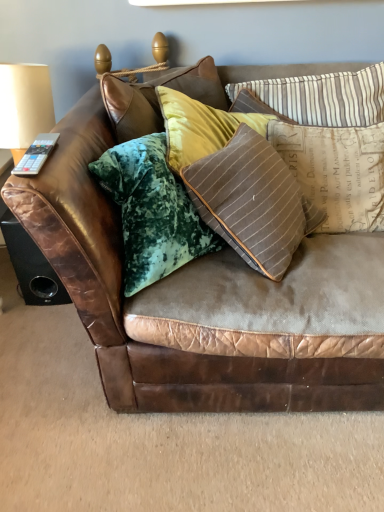
Describe the element at coordinates (31, 265) in the screenshot. I see `brown leather speaker at lower left` at that location.

I want to click on striped fabric pillow at upper right, placed as the first pillow when sorted from top to bottom, so click(322, 96).

Locate an element on the screen. This screenshot has height=512, width=384. matte beige lampshade at upper left is located at coordinates (24, 106).

Find the location of `brown leather speaker at lower left`. brown leather speaker at lower left is located at coordinates (31, 265).

Does point (364, 180) lie behind point (30, 170)?

Yes, it is.

Find the location of `the 2nd pillow counting from the right of the gray plastic remote at upper left`. the 2nd pillow counting from the right of the gray plastic remote at upper left is located at coordinates (336, 170).

Is brown striped pillow at upper right, positioned as the first pillow in bottom-to-top order, positioned beyond the bounds of gray plastic remote at upper left?

Yes, brown striped pillow at upper right, positioned as the first pillow in bottom-to-top order, is outside of gray plastic remote at upper left.

Is brown striped pillow at upper right, arranged as the second pillow when viewed from the top, wider than gray plastic remote at upper left?

Indeed, brown striped pillow at upper right, arranged as the second pillow when viewed from the top, has a greater width compared to gray plastic remote at upper left.

Is striped fabric pillow at upper right, placed as the first pillow when sorted from top to bottom, looking in the opposite direction of gray plastic remote at upper left?

No, gray plastic remote at upper left is not at the back of striped fabric pillow at upper right, placed as the first pillow when sorted from top to bottom.

From the picture: Can you confirm if striped fabric pillow at upper right, placed as the first pillow when sorted from top to bottom, is wider than gray plastic remote at upper left?

Incorrect, the width of striped fabric pillow at upper right, placed as the first pillow when sorted from top to bottom, does not surpass that of gray plastic remote at upper left.

The height and width of the screenshot is (512, 384). What are the coordinates of `pillow that is the 1st object directly below the gray plastic remote at upper left (from a real-world perspective)` in the screenshot? It's located at (x=322, y=96).

Between point (340, 114) and point (22, 165), which one is positioned in front?

The point (22, 165) is closer to the camera.

You are a GUI agent. You are given a task and a screenshot of the screen. Output one action in this format:
    pyautogui.click(x=<x>, y=<y>)
    Task: Click on the 1st pillow positioned above the brown leather speaker at lower left (from a real-world perspective)
    
    Given the screenshot: What is the action you would take?
    pyautogui.click(x=336, y=170)

Is brown striped pillow at upper right, positioned as the first pillow in bottom-to-top order, positioned with its back to brown leather speaker at lower left?

No, brown striped pillow at upper right, positioned as the first pillow in bottom-to-top order, is not facing the opposite direction of brown leather speaker at lower left.

Can you confirm if brown striped pillow at upper right, arranged as the second pillow when viewed from the top, is bigger than brown leather speaker at lower left?

Indeed, brown striped pillow at upper right, arranged as the second pillow when viewed from the top, has a larger size compared to brown leather speaker at lower left.

Is brown striped pillow at upper right, arranged as the second pillow when viewed from the top, directly adjacent to brown leather speaker at lower left?

They are not placed beside each other.

How different are the orientations of brown leather speaker at lower left and gray plastic remote at upper left in degrees?

The angle between the facing direction of brown leather speaker at lower left and the facing direction of gray plastic remote at upper left is 0.657 degrees.

Is brown leather speaker at lower left aimed at gray plastic remote at upper left?

No, brown leather speaker at lower left is not aimed at gray plastic remote at upper left.

Considering the relative sizes of brown leather speaker at lower left and gray plastic remote at upper left in the image provided, is brown leather speaker at lower left taller than gray plastic remote at upper left?

Indeed, brown leather speaker at lower left has a greater height compared to gray plastic remote at upper left.

Is brown leather speaker at lower left placed right next to gray plastic remote at upper left?

No, brown leather speaker at lower left is not touching gray plastic remote at upper left.

Could you tell me if brown striped pillow at upper right, arranged as the second pillow when viewed from the top, is turned towards striped fabric pillow at upper right, which appears as the second pillow when ordered from the bottom?

No, brown striped pillow at upper right, arranged as the second pillow when viewed from the top, is not aimed at striped fabric pillow at upper right, which appears as the second pillow when ordered from the bottom.

Considering the sizes of objects brown striped pillow at upper right, arranged as the second pillow when viewed from the top, and striped fabric pillow at upper right, which appears as the second pillow when ordered from the bottom, in the image provided, who is shorter, brown striped pillow at upper right, arranged as the second pillow when viewed from the top, or striped fabric pillow at upper right, which appears as the second pillow when ordered from the bottom,?

striped fabric pillow at upper right, which appears as the second pillow when ordered from the bottom, is shorter.

Is brown striped pillow at upper right, arranged as the second pillow when viewed from the top, closer to the viewer compared to striped fabric pillow at upper right, which appears as the second pillow when ordered from the bottom?

That is True.

Is brown striped pillow at upper right, positioned as the first pillow in bottom-to-top order, situated inside striped fabric pillow at upper right, which appears as the second pillow when ordered from the bottom, or outside?

brown striped pillow at upper right, positioned as the first pillow in bottom-to-top order, is located beyond the bounds of striped fabric pillow at upper right, which appears as the second pillow when ordered from the bottom.

From a real-world perspective, which object rests below the other?

From a 3D spatial view, brown striped pillow at upper right, arranged as the second pillow when viewed from the top, is below.

Identify the location of table lamp positioned vertically above the brown striped pillow at upper right, positioned as the first pillow in bottom-to-top order (from a real-world perspective). The image size is (384, 512). (24, 106).

Which is nearer, (46, 81) or (382, 223)?

The point (382, 223) is closer to the camera.

From the image's perspective, would you say matte beige lampshade at upper left is shown under brown striped pillow at upper right, positioned as the first pillow in bottom-to-top order?

Actually, matte beige lampshade at upper left appears above brown striped pillow at upper right, positioned as the first pillow in bottom-to-top order, in the image.

Between striped fabric pillow at upper right, which appears as the second pillow when ordered from the bottom, and brown leather speaker at lower left, which one has smaller size?

Smaller between the two is striped fabric pillow at upper right, which appears as the second pillow when ordered from the bottom.

Based on the photo, is striped fabric pillow at upper right, placed as the first pillow when sorted from top to bottom, completely or partially outside of brown leather speaker at lower left?

Yes, striped fabric pillow at upper right, placed as the first pillow when sorted from top to bottom, is outside of brown leather speaker at lower left.

Based on the photo, from the image's perspective, does striped fabric pillow at upper right, placed as the first pillow when sorted from top to bottom, appear higher than brown leather speaker at lower left?

Yes.

Is point (359, 126) closer or farther from the camera than point (19, 251)?

Clearly, point (359, 126) is closer to the camera than point (19, 251).

The image size is (384, 512). In order to click on remote on the left of brown striped pillow at upper right, arranged as the second pillow when viewed from the top in this screenshot , I will do `click(36, 154)`.

You are a GUI agent. You are given a task and a screenshot of the screen. Output one action in this format:
    pyautogui.click(x=<x>, y=<y>)
    Task: Click on the 1st pillow to the right of the gray plastic remote at upper left, starting your count from the anchor
    
    Given the screenshot: What is the action you would take?
    pyautogui.click(x=322, y=96)

Looking at the image, which one is located further to striped fabric pillow at upper right, placed as the first pillow when sorted from top to bottom, gray plastic remote at upper left or matte beige lampshade at upper left?

Based on the image, gray plastic remote at upper left appears to be further to striped fabric pillow at upper right, placed as the first pillow when sorted from top to bottom.

When comparing their distances from brown leather couch at center, does striped fabric pillow at upper right, placed as the first pillow when sorted from top to bottom, or brown striped pillow at upper right, positioned as the first pillow in bottom-to-top order, seem further?

striped fabric pillow at upper right, placed as the first pillow when sorted from top to bottom, lies further to brown leather couch at center than the other object.

Looking at the image, which one is located further to striped fabric pillow at upper right, which appears as the second pillow when ordered from the bottom, brown leather speaker at lower left or matte beige lampshade at upper left?

brown leather speaker at lower left lies further to striped fabric pillow at upper right, which appears as the second pillow when ordered from the bottom, than the other object.

Estimate the real-world distances between objects in this image. Which object is closer to gray plastic remote at upper left, brown leather speaker at lower left or matte beige lampshade at upper left?

matte beige lampshade at upper left is positioned closer to the anchor gray plastic remote at upper left.

Looking at the image, which one is located further to gray plastic remote at upper left, striped fabric pillow at upper right, placed as the first pillow when sorted from top to bottom, or matte beige lampshade at upper left?

striped fabric pillow at upper right, placed as the first pillow when sorted from top to bottom.

Considering their positions, is gray plastic remote at upper left positioned closer to brown striped pillow at upper right, positioned as the first pillow in bottom-to-top order, than brown leather couch at center?

Based on the image, brown leather couch at center appears to be nearer to brown striped pillow at upper right, positioned as the first pillow in bottom-to-top order.

Based on their spatial positions, is matte beige lampshade at upper left or brown leather couch at center closer to brown striped pillow at upper right, positioned as the first pillow in bottom-to-top order?

brown leather couch at center.

From the picture: Looking at the image, which one is located closer to brown leather couch at center, gray plastic remote at upper left or brown leather speaker at lower left?

gray plastic remote at upper left is closer to brown leather couch at center.

At what (x,y) coordinates should I click in order to perform the action: click on remote between brown leather speaker at lower left and brown striped pillow at upper right, arranged as the second pillow when viewed from the top, from left to right. Please return your answer as a coordinate pair (x, y). Looking at the image, I should click on (36, 154).

Where is `studio couch located between brown leather speaker at lower left and striped fabric pillow at upper right, which appears as the second pillow when ordered from the bottom, in the left-right direction`? studio couch located between brown leather speaker at lower left and striped fabric pillow at upper right, which appears as the second pillow when ordered from the bottom, in the left-right direction is located at coordinates (125, 300).

At what (x,y) coordinates should I click in order to perform the action: click on pillow situated between matte beige lampshade at upper left and brown striped pillow at upper right, positioned as the first pillow in bottom-to-top order, from left to right. Please return your answer as a coordinate pair (x, y). Looking at the image, I should click on (322, 96).

This screenshot has width=384, height=512. Find the location of `remote located between matte beige lampshade at upper left and brown striped pillow at upper right, arranged as the second pillow when viewed from the top, in the left-right direction`. remote located between matte beige lampshade at upper left and brown striped pillow at upper right, arranged as the second pillow when viewed from the top, in the left-right direction is located at coordinates (36, 154).